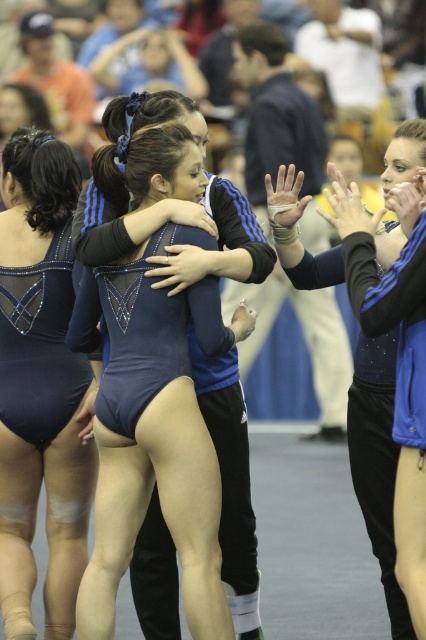
Measure the distance between shiny blue leotard at center and matte blue leotard at center.

They are 31.14 inches apart.

In the scene shown: Can you confirm if shiny blue leotard at center is wider than matte blue leotard at center?

Correct, the width of shiny blue leotard at center exceeds that of matte blue leotard at center.

The height and width of the screenshot is (640, 426). I want to click on shiny blue leotard at center, so click(x=158, y=435).